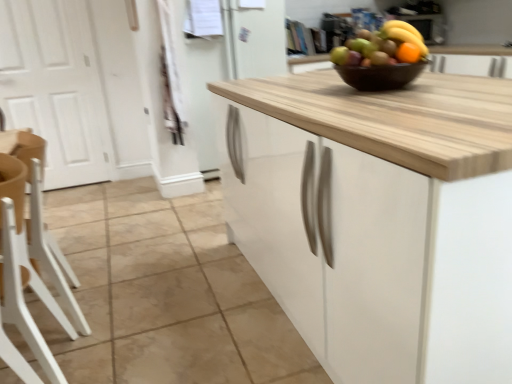
Question: Is point (412, 33) closer or farther from the camera than point (419, 57)?

Choices:
 (A) closer
 (B) farther

Answer: (B)

Question: Is yellow matte bananas at upper center taller or shorter than orange matte grapefruit at upper center?

Choices:
 (A) tall
 (B) short

Answer: (A)

Question: Considering the real-world distances, which object is farthest from the orange matte grapefruit at upper center?

Choices:
 (A) natural stone tile at center
 (B) white matte door at left
 (C) black glossy bowl at center
 (D) yellow matte bananas at upper center
 (E) white plastic chair at lower left, the 1th chair in the front-to-back sequence

Answer: (B)

Question: Estimate the real-world distances between objects in this image. Which object is closer to the black glossy bowl at center?

Choices:
 (A) white wood chair at left, the 1th chair viewed from the back
 (B) yellow matte bananas at upper center
 (C) white matte door at left
 (D) orange matte grapefruit at upper center
 (E) natural stone tile at center

Answer: (D)